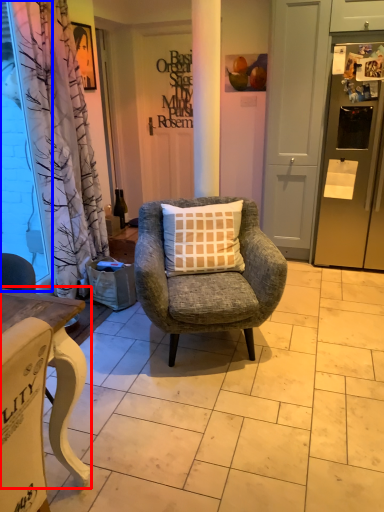
Question: Which of the following is the farthest to the observer, desk (highlighted by a red box) or window screen (highlighted by a blue box)?

Choices:
 (A) desk
 (B) window screen

Answer: (B)